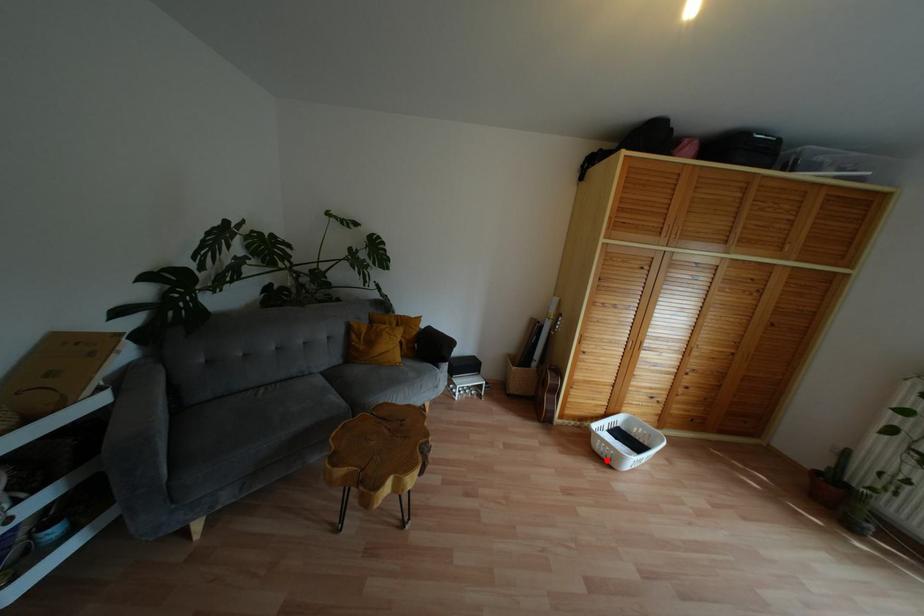
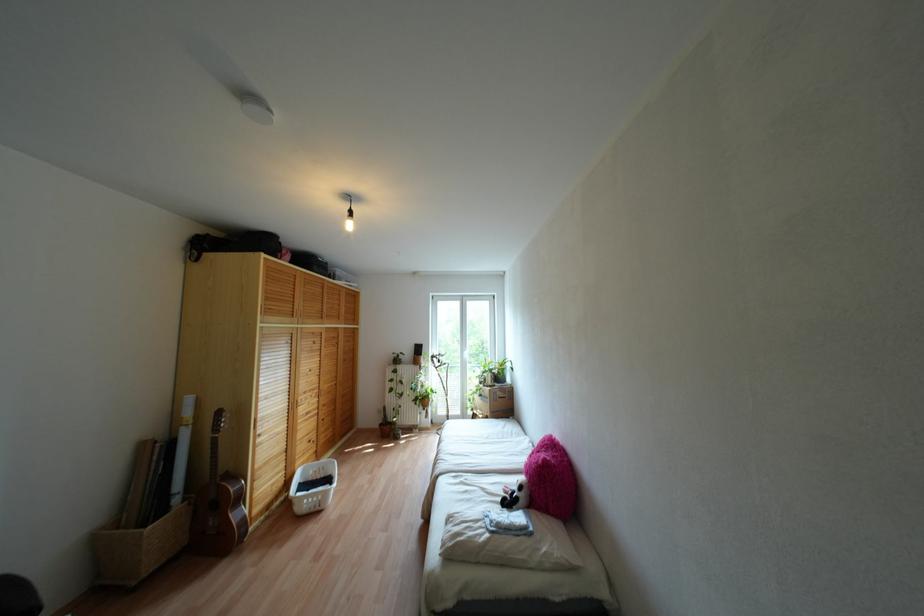
The point at the highlighted location is marked in the first image. Where is the corresponding point in the second image?

(317, 508)